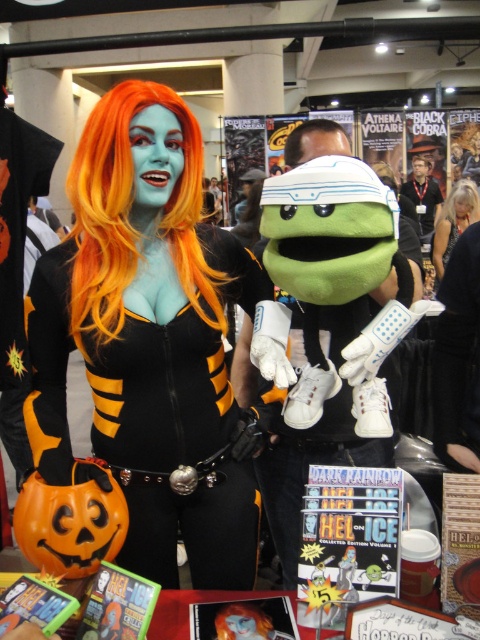
You are standing at the convention and want to take a photo of the point at coordinates (155, 90). Your camera has a maximum focus range of 1.2 meters. Will you be able to focus on the point?

The distance between the point at coordinates (155, 90) and the viewer is 1.16 meters, which is within the camera maximum focus range of 1.2 meters. So yes, you can focus on the point.

Please look at the image and locate the point at coordinates (129, 214). What object is located at that exact point?

The point at coordinates (129, 214) corresponds to the orange synthetic wig at center.